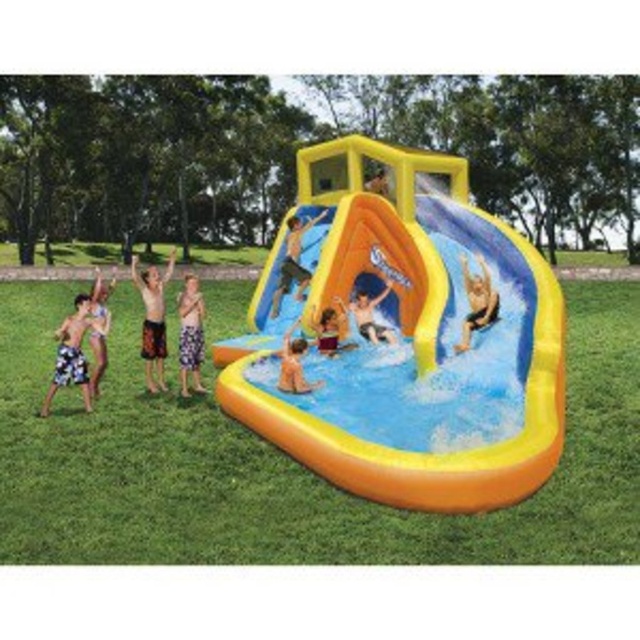
Does tan skin man at center appear on the left side of smooth yellow slide at center?

Correct, you'll find tan skin man at center to the left of smooth yellow slide at center.

How distant is tan skin man at center from smooth yellow slide at center?

tan skin man at center and smooth yellow slide at center are 7.09 feet apart from each other.

Find the location of a particular element. This screenshot has width=640, height=640. tan skin man at center is located at coordinates (292, 260).

Who is taller, blue printed shorts at left or light blue fabric shorts at left?

With more height is light blue fabric shorts at left.

Between point (49, 401) and point (96, 355), which one is positioned behind?

Point (96, 355)

Measure the distance between point (81, 339) and camera.

A distance of 12.56 meters exists between point (81, 339) and camera.

The height and width of the screenshot is (640, 640). Identify the location of blue printed shorts at left. (72, 353).

Does point (468, 305) come closer to viewer compared to point (326, 342)?

Yes, it is in front of point (326, 342).

Between smooth yellow swim trunks at center and smooth yellow slide at center, which one appears on the right side from the viewer's perspective?

smooth yellow swim trunks at center

Is point (486, 273) less distant than point (344, 348)?

Yes, point (486, 273) is in front of point (344, 348).

Locate an element on the screen. The height and width of the screenshot is (640, 640). smooth yellow swim trunks at center is located at coordinates (476, 301).